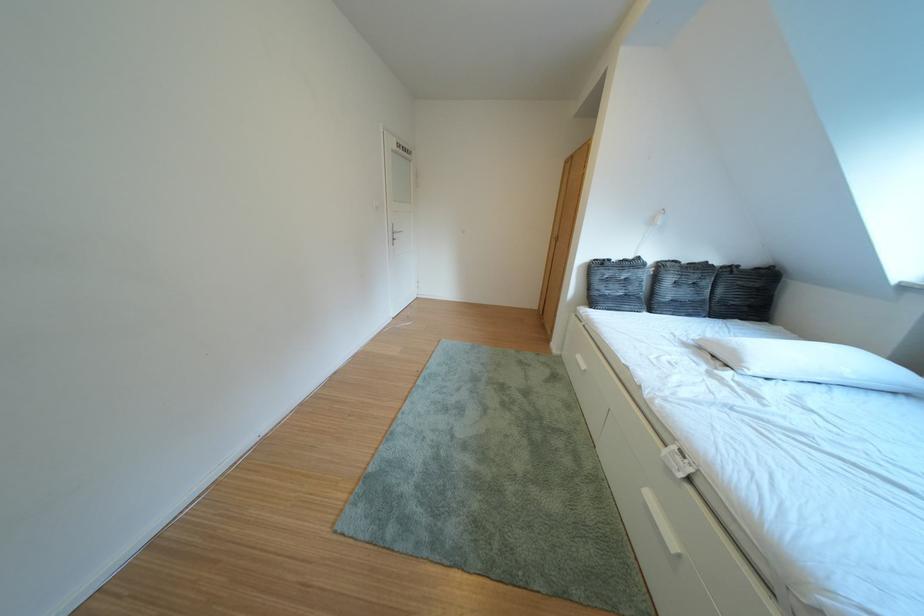
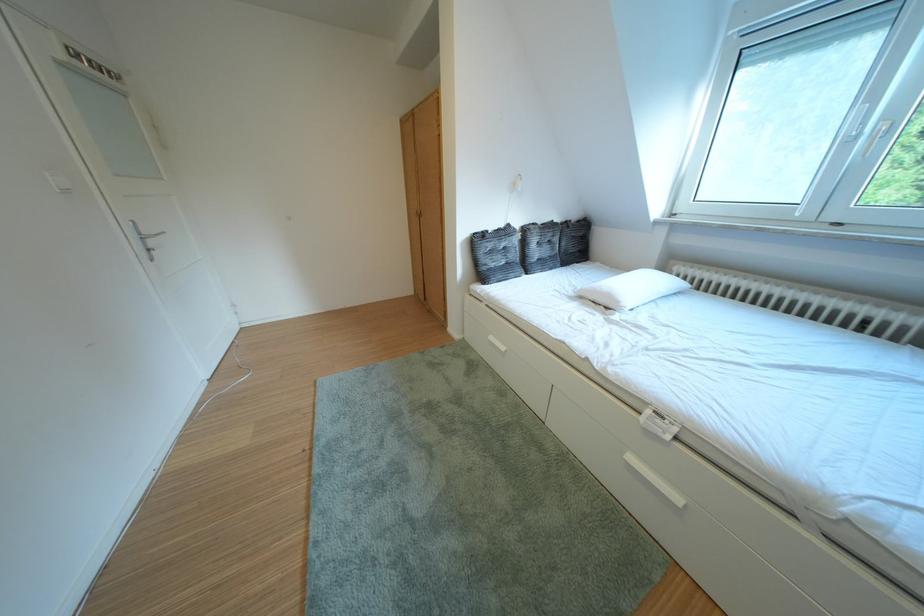
Find the pixel in the second image that matches (624,265) in the first image.

(500, 237)